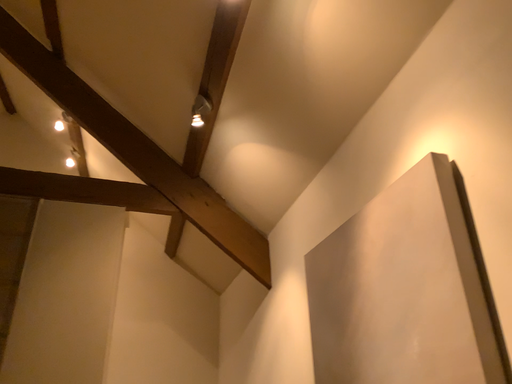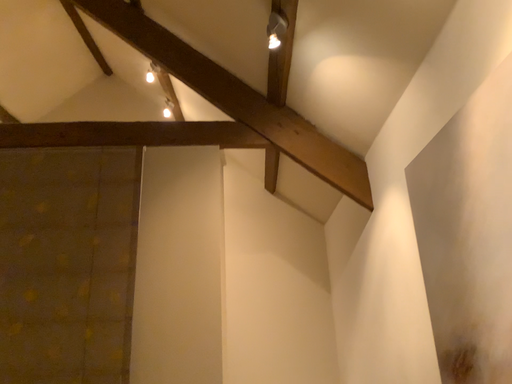
Question: How did the camera likely rotate when shooting the video?

Choices:
 (A) rotated downward
 (B) rotated upward

Answer: (A)